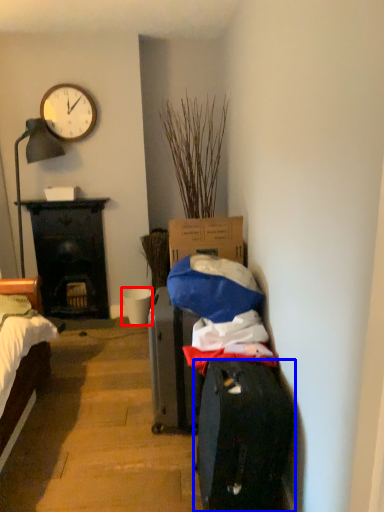
Question: Which object appears farthest to the camera in this image, bucket (highlighted by a red box) or luggage and bags (highlighted by a blue box)?

Choices:
 (A) bucket
 (B) luggage and bags

Answer: (A)